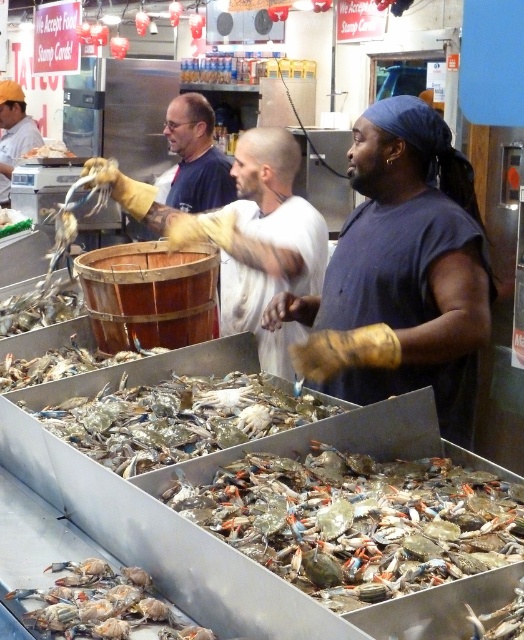
Question: Based on their relative distances, which object is nearer to the yellow rubber gloves at center?

Choices:
 (A) translucent plastic crab at lower left
 (B) matte white shirt at left

Answer: (A)

Question: Does translucent plastic crabs at center appear over matte white shirt at left?

Choices:
 (A) no
 (B) yes

Answer: (A)

Question: Is dark blue t-shirt at center positioned at the back of translucent plastic crabs at center?

Choices:
 (A) yes
 (B) no

Answer: (A)

Question: Among these points, which one is farthest from the camera?

Choices:
 (A) (252, 412)
 (B) (259, 148)
 (C) (17, 128)

Answer: (C)

Question: Can you confirm if yellow rubber gloves at center is positioned above translucent plastic crabs at center?

Choices:
 (A) yes
 (B) no

Answer: (A)

Question: Which point is farther to the camera?

Choices:
 (A) translucent plastic crab at lower left
 (B) shiny metallic crab at center
 (C) yellow rubber gloves at center

Answer: (C)